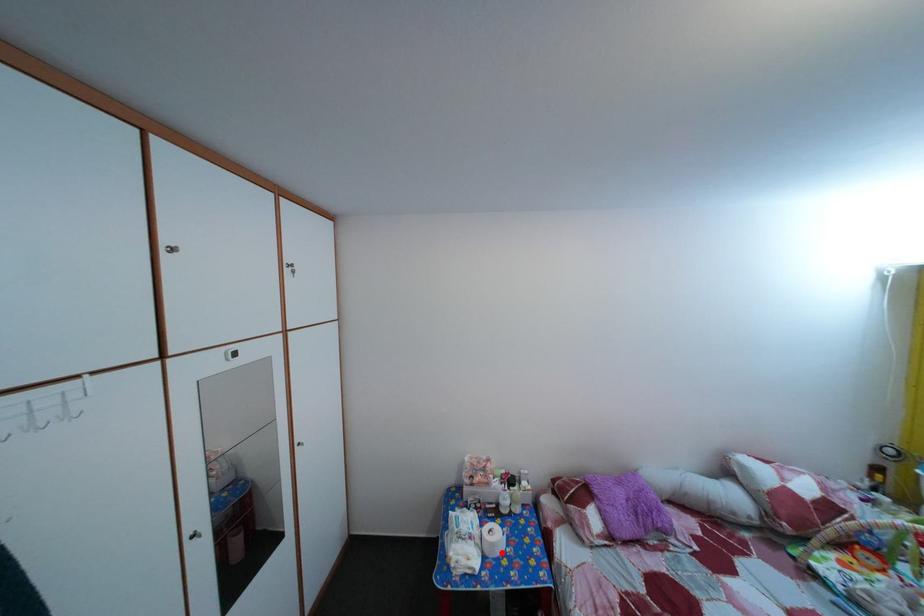
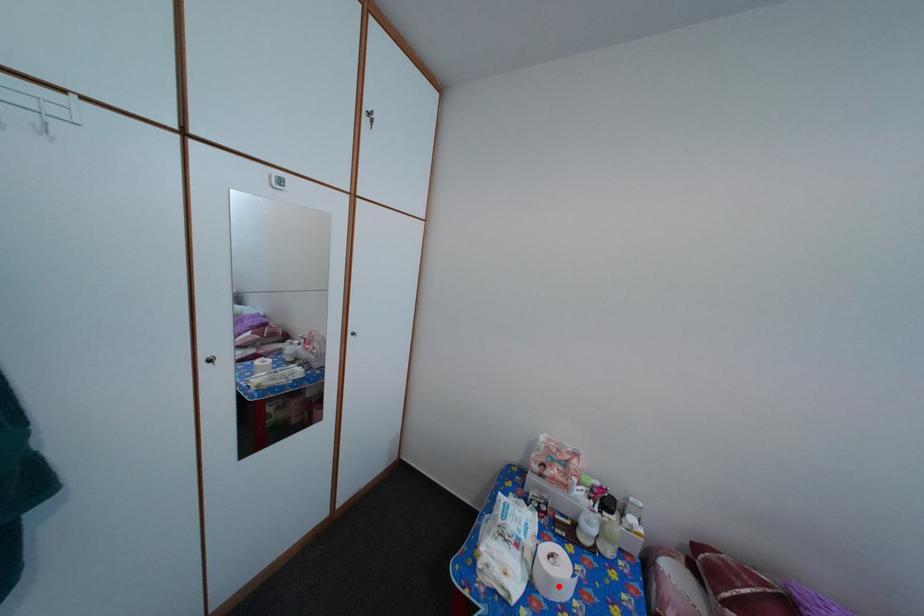
I am providing you with two images of the same scene from different viewpoints. A red point is marked on the first image and another point is marked on the second image. Is the red point in image1 aligned with the point shown in image2?

Yes